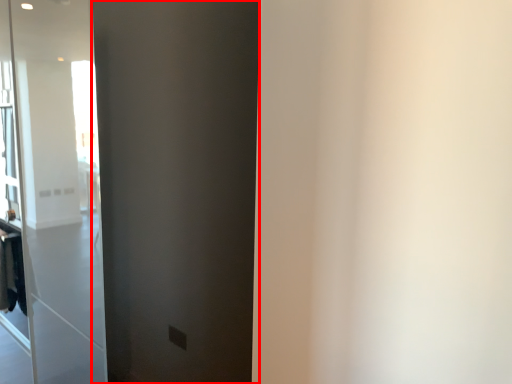
Question: In this image, where is barn door (annotated by the red box) located relative to laundry?

Choices:
 (A) right
 (B) left

Answer: (A)